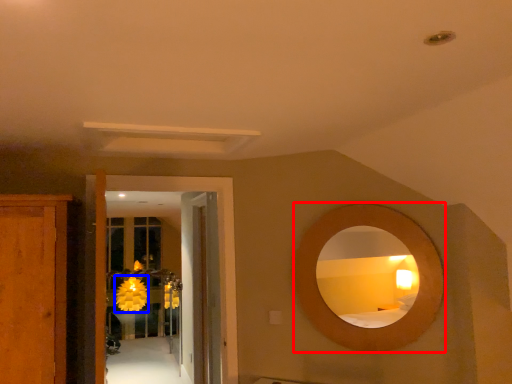
Question: Which of the following is the farthest to the observer, mirror (highlighted by a red box) or flower (highlighted by a blue box)?

Choices:
 (A) mirror
 (B) flower

Answer: (B)